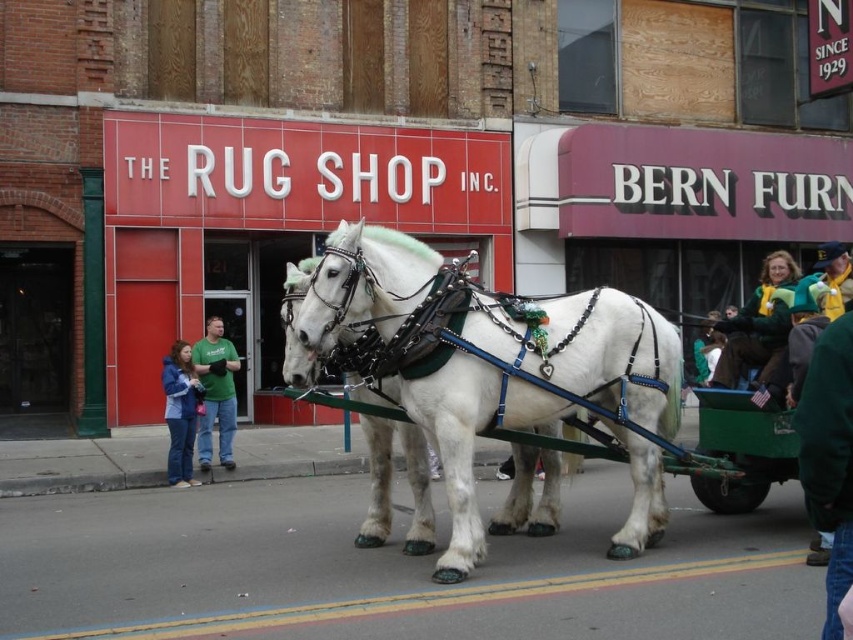
You are standing at point (488, 356) in the street scene. What object is located exactly at this point?

The white glossy horse at center is located exactly at point (488, 356).